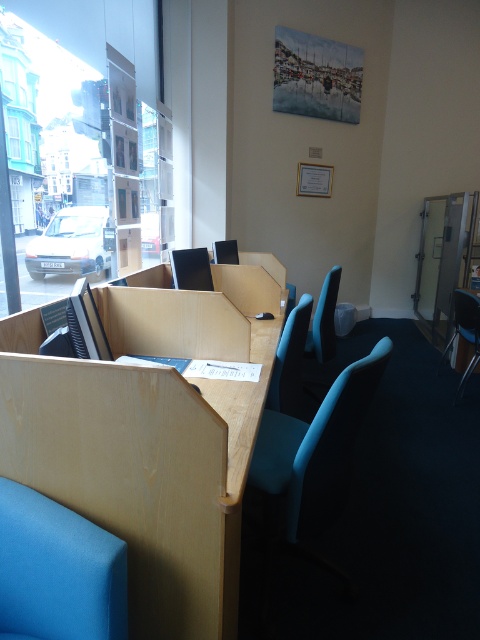
Between blue fabric swivel chair at lower left and blue fabric chair at center, which one is positioned lower?

blue fabric swivel chair at lower left is lower down.

Which is above, blue fabric swivel chair at lower left or blue fabric chair at center?

blue fabric chair at center is above.

You are a GUI agent. You are given a task and a screenshot of the screen. Output one action in this format:
    pyautogui.click(x=<x>, y=<y>)
    Task: Click on the blue fabric swivel chair at lower left
    
    Given the screenshot: What is the action you would take?
    pyautogui.click(x=58, y=572)

Who is taller, matte blue chair at center or blue fabric chair at center?

Standing taller between the two is blue fabric chair at center.

Find the location of a particular element. The width and height of the screenshot is (480, 640). matte blue chair at center is located at coordinates (316, 449).

Where is `matte blue chair at center`? matte blue chair at center is located at coordinates (316, 449).

Does blue fabric swivel chair at lower left appear on the right side of matte black chair at right?

In fact, blue fabric swivel chair at lower left is to the left of matte black chair at right.

Does blue fabric swivel chair at lower left appear over matte black chair at right?

Actually, blue fabric swivel chair at lower left is below matte black chair at right.

Where is `blue fabric swivel chair at lower left`? This screenshot has height=640, width=480. blue fabric swivel chair at lower left is located at coordinates (58, 572).